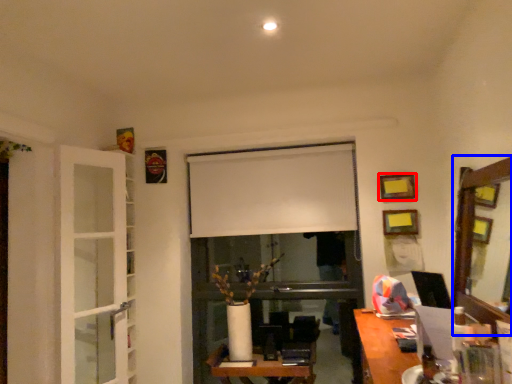
Question: Which object appears closest to the camera in this image, picture frame (highlighted by a red box) or mirror (highlighted by a blue box)?

Choices:
 (A) picture frame
 (B) mirror

Answer: (B)